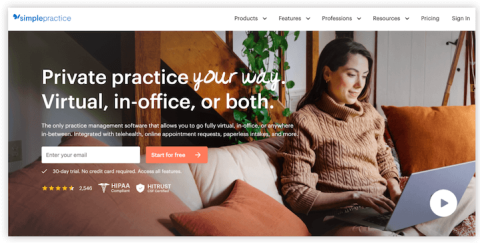
I want to click on grey laptop on the woman's lap, so click(409, 213).